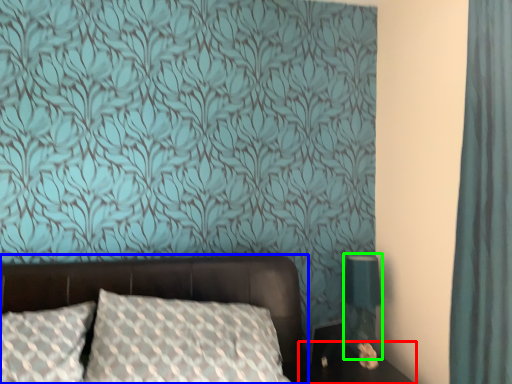
Question: Which is farther away from table (highlighted by a red box)? bed (highlighted by a blue box) or table lamp (highlighted by a green box)?

Choices:
 (A) bed
 (B) table lamp

Answer: (A)